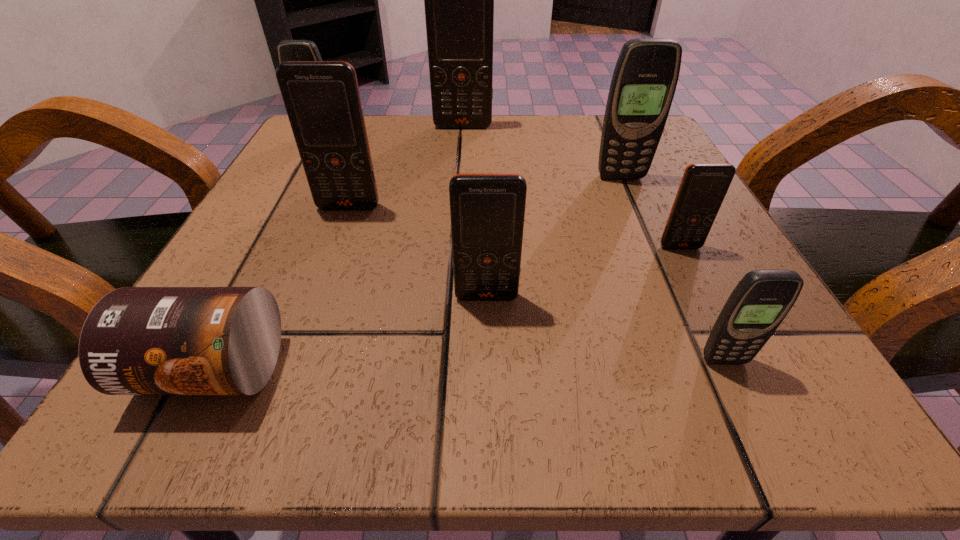
The image size is (960, 540). Find the location of `free space located 0.090m on the screen of the smallest orange cellular telephone`. free space located 0.090m on the screen of the smallest orange cellular telephone is located at coordinates (705, 295).

At what (x,y) coordinates should I click in order to perform the action: click on vacant space situated 0.060m on the screen of the nearest gray cellular telephone. Please return your answer as a coordinate pair (x, y). This screenshot has height=540, width=960. Looking at the image, I should click on (750, 414).

At what (x,y) coordinates should I click in order to perform the action: click on cellular telephone that is at the near edge. Please return your answer as a coordinate pair (x, y). The width and height of the screenshot is (960, 540). Looking at the image, I should click on (759, 303).

At what (x,y) coordinates should I click in order to perform the action: click on can located at the near edge. Please return your answer as a coordinate pair (x, y). The height and width of the screenshot is (540, 960). Looking at the image, I should click on (136, 340).

Where is `can positioned at the left edge`? can positioned at the left edge is located at coordinates (x=136, y=340).

In order to click on object at the far left corner in this screenshot , I will do `click(288, 50)`.

Where is `object located at the near left corner`? The image size is (960, 540). object located at the near left corner is located at coordinates (136, 340).

This screenshot has width=960, height=540. Find the location of `object that is positioned at the far right corner`. object that is positioned at the far right corner is located at coordinates (645, 77).

You are a GUI agent. You are given a task and a screenshot of the screen. Output one action in this format:
    pyautogui.click(x=<x>, y=<y>)
    Task: Click on the object that is at the near right corner
    
    Given the screenshot: What is the action you would take?
    pyautogui.click(x=759, y=303)

Locate an element on the screen. vacant space at the far edge of the desktop is located at coordinates (394, 163).